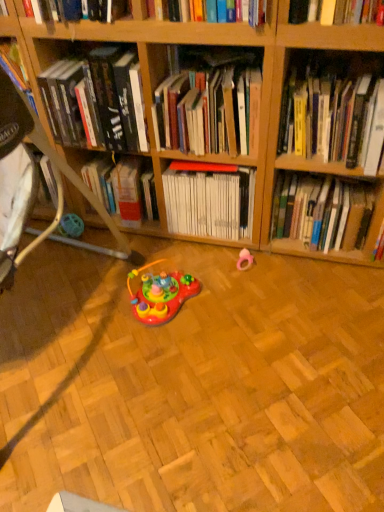
Where is `vacant space to the right of pink rubber ring at center, the 2th toy when ordered from left to right`? This screenshot has width=384, height=512. vacant space to the right of pink rubber ring at center, the 2th toy when ordered from left to right is located at coordinates (290, 268).